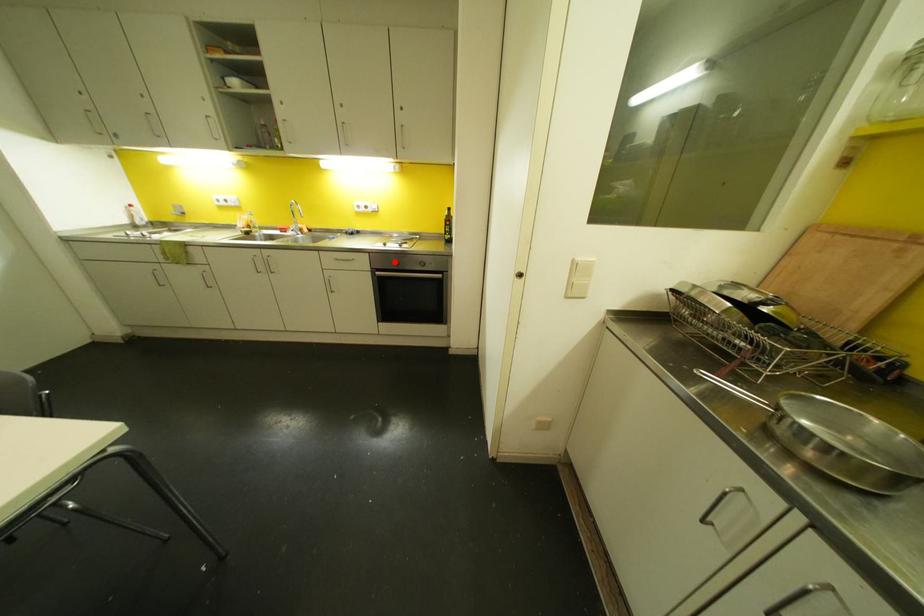
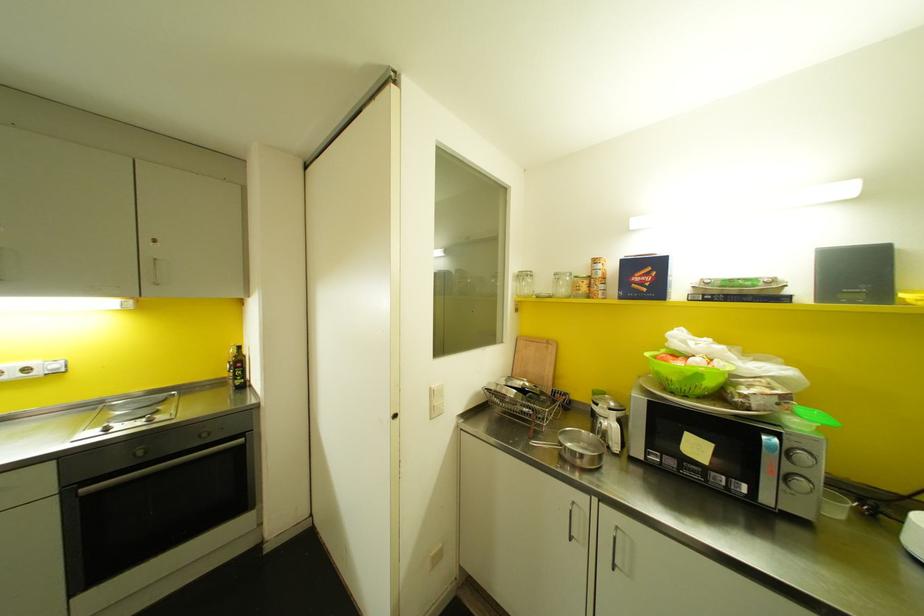
Locate, in the second image, the point that corresponds to the highlighted location in the first image.

(140, 451)